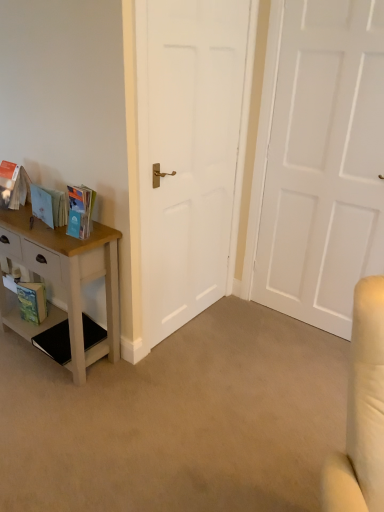
The height and width of the screenshot is (512, 384). I want to click on vacant space situated on the left part of matte cardboard book at left, the second book positioned from the right, so click(20, 221).